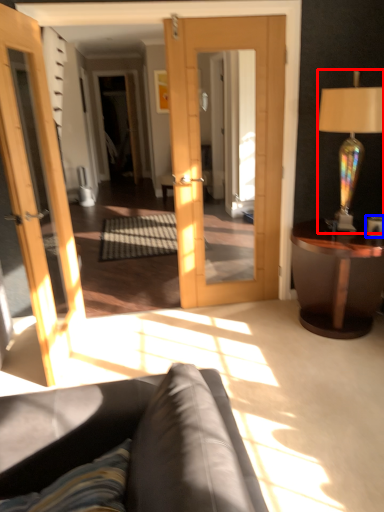
Question: Which of the following is the farthest to the observer, lamp (highlighted by a red box) or coffee cup (highlighted by a blue box)?

Choices:
 (A) lamp
 (B) coffee cup

Answer: (B)